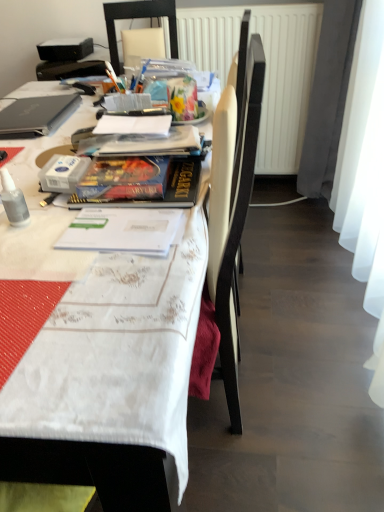
Identify the location of free location in front of transparent plastic bottle at left. [31, 255].